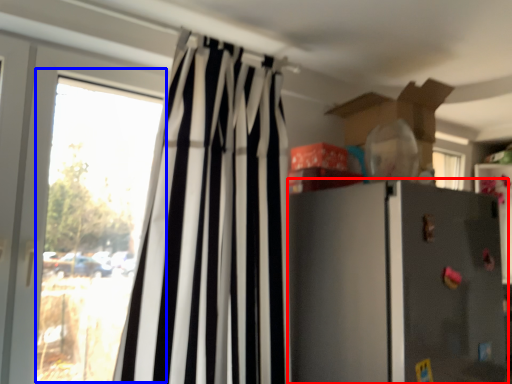
Question: Which object is further to the camera taking this photo, refrigerator (highlighted by a red box) or window (highlighted by a blue box)?

Choices:
 (A) refrigerator
 (B) window

Answer: (B)